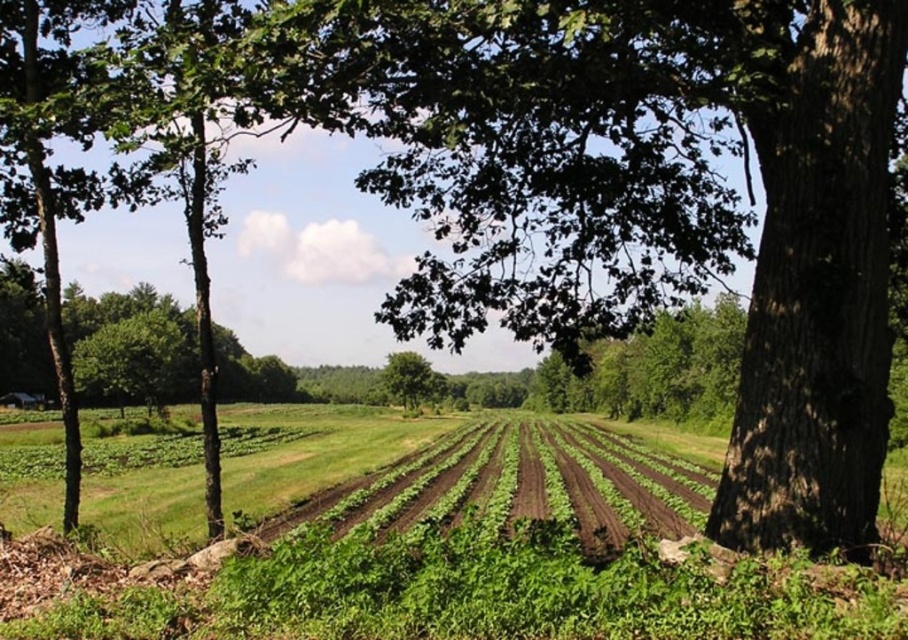
What are the coordinates of the green leafy grass at center?

The green leafy grass at center is located at coordinates point (471, 561).

You are a farmer checking the growth of your crops. You notice two green leafy plants in the field. Which one has a wider spread, the green leafy grass at center or the green leafy tree at center?

The green leafy grass at center has a larger width than the green leafy tree at center according to the description.